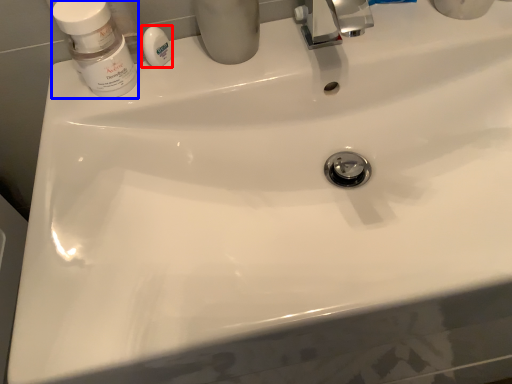
Question: Which point is closer to the camera, soap (highlighted by a red box) or mouthwash (highlighted by a blue box)?

Choices:
 (A) soap
 (B) mouthwash

Answer: (B)